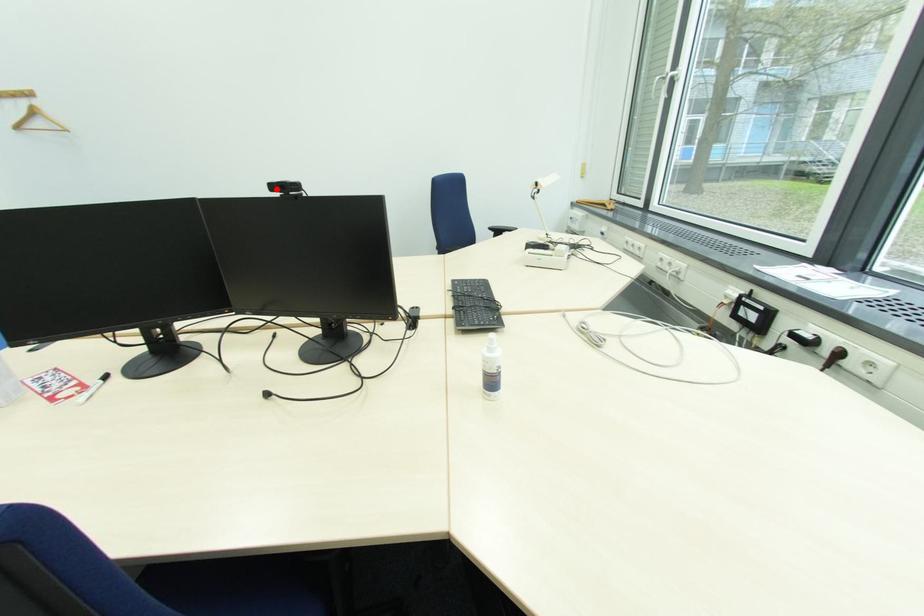
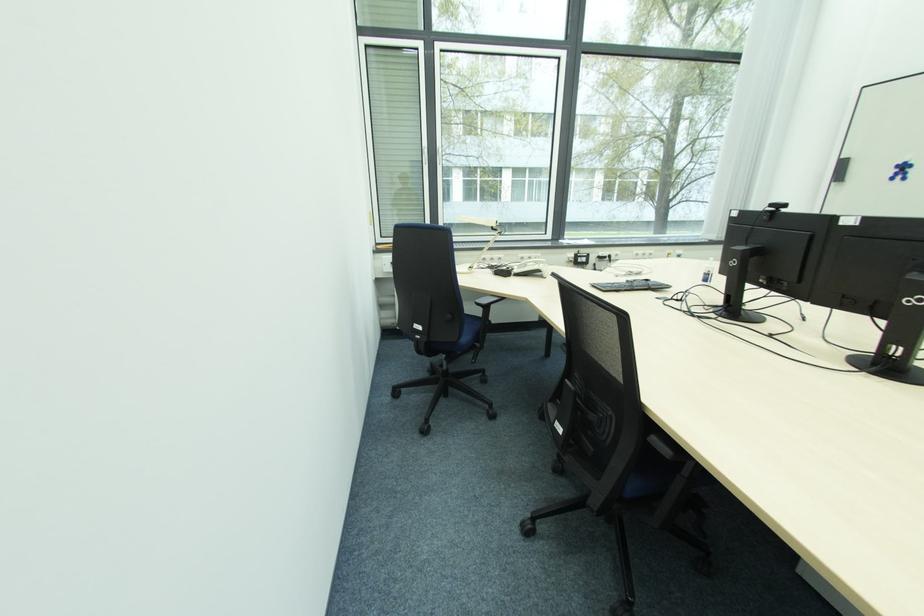
Question: I am providing you with two images of the same scene from different viewpoints. A red point is marked on the first image. At the location where the point appears in image 1, is it still visible in image 2?

Choices:
 (A) Yes
 (B) No

Answer: (B)